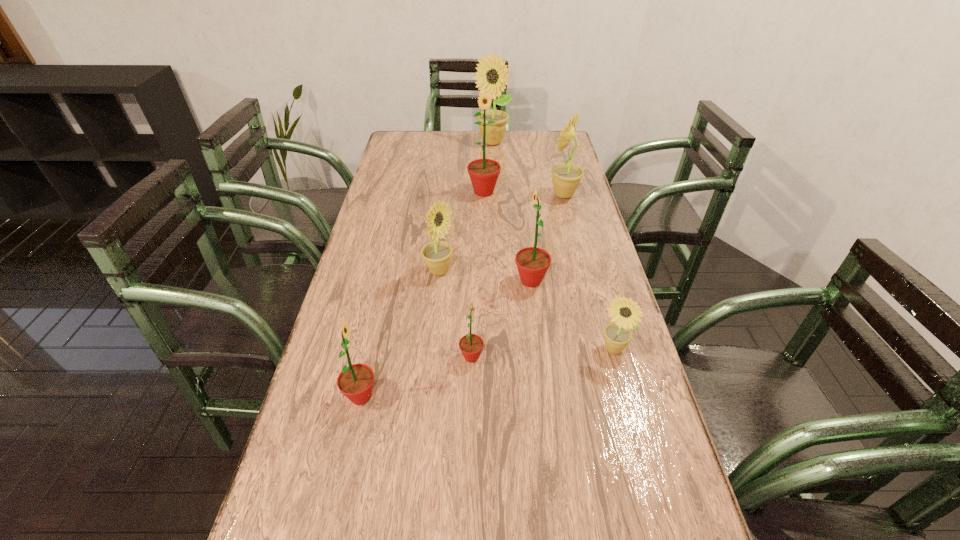
Where is `the farthest yellow sunflower`? the farthest yellow sunflower is located at coordinates (491, 70).

Image resolution: width=960 pixels, height=540 pixels. What are the coordinates of `the farthest sunflower` in the screenshot? It's located at (491, 70).

This screenshot has height=540, width=960. What are the coordinates of `the biggest green sunflower` in the screenshot? It's located at (483, 173).

You are a GUI agent. You are given a task and a screenshot of the screen. Output one action in this format:
    pyautogui.click(x=<x>, y=<y>)
    Task: Click on the third nearest yellow sunflower
    Image resolution: width=960 pixels, height=540 pixels.
    Given the screenshot: What is the action you would take?
    pyautogui.click(x=566, y=177)

Locate an element on the screen. the second farthest green sunflower is located at coordinates (532, 262).

Identify the location of the rightmost green sunflower. (532, 262).

Identify the location of the leftmost yellow sunflower. The height and width of the screenshot is (540, 960). (437, 255).

This screenshot has height=540, width=960. Identify the location of the second nearest yellow sunflower. (437, 255).

Where is `the leftmost green sunflower`? the leftmost green sunflower is located at coordinates (356, 381).

I want to click on the nearest object, so click(x=356, y=381).